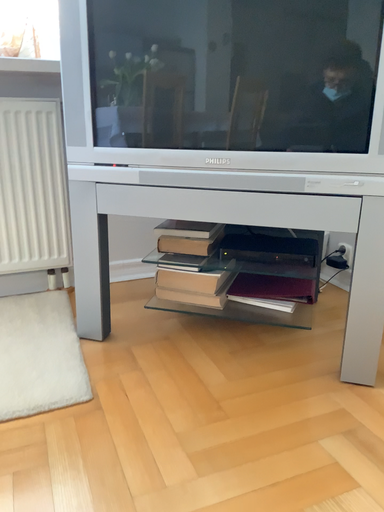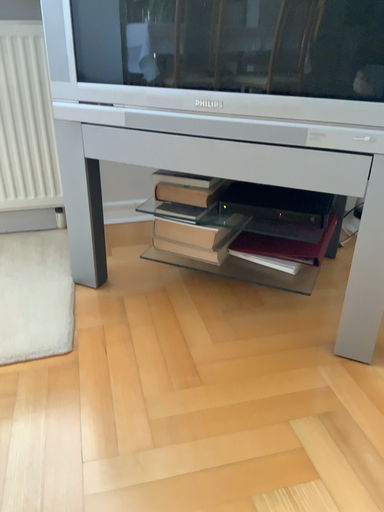
Question: Which way did the camera rotate in the video?

Choices:
 (A) rotated upward
 (B) rotated downward

Answer: (B)